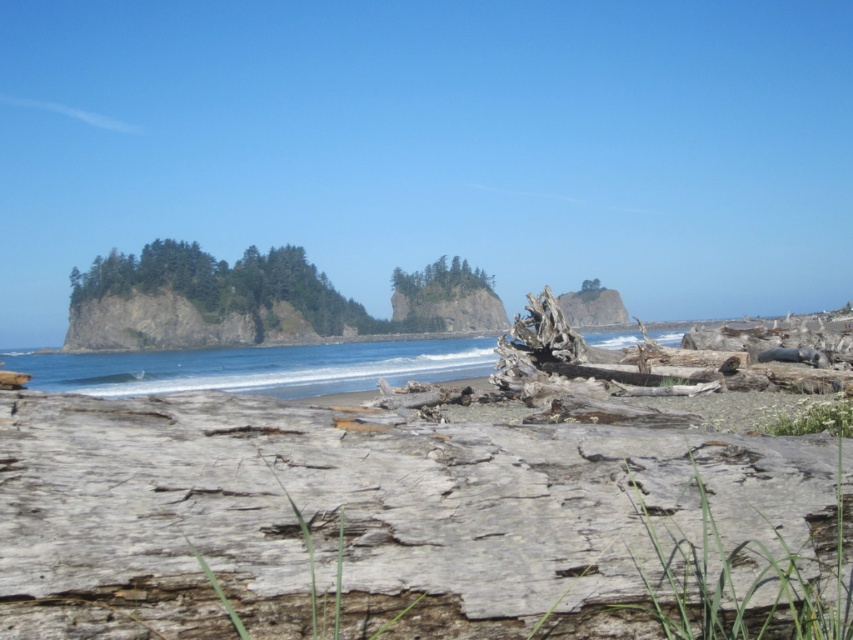
Question: From the image, what is the correct spatial relationship of green rough rock island at left in relation to green textured trees at center?

Choices:
 (A) left
 (B) right

Answer: (A)

Question: Does green rough rock island at left have a larger size compared to green textured trees at center?

Choices:
 (A) yes
 (B) no

Answer: (A)

Question: Which object appears closest to the camera in this image?

Choices:
 (A) green rough rock island at left
 (B) green textured trees at center

Answer: (A)

Question: Can you confirm if green rough rock island at left is positioned above green textured trees at center?

Choices:
 (A) yes
 (B) no

Answer: (B)